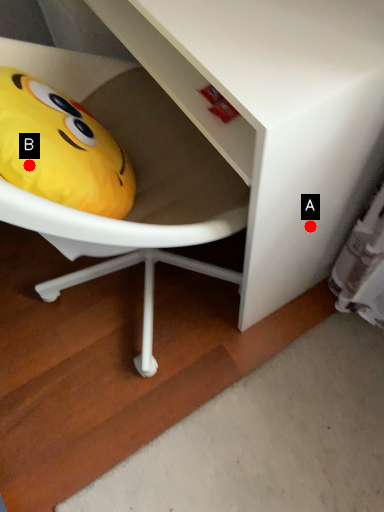
Question: Two points are circled on the image, labeled by A and B beside each circle. Among these points, which one is nearest to the camera?

Choices:
 (A) A is closer
 (B) B is closer

Answer: (B)